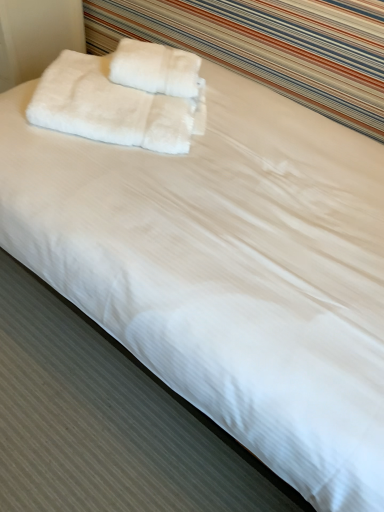
Question: Visually, is white fluffy towels at upper left, which is the 1th towel from left to right, positioned to the left or to the right of white fluffy towel at upper center, the 1th towel positioned from the right?

Choices:
 (A) right
 (B) left

Answer: (B)

Question: Is white fluffy towels at upper left, the second towel viewed from the right, bigger or smaller than white fluffy towel at upper center, the 2th towel viewed from the left?

Choices:
 (A) big
 (B) small

Answer: (A)

Question: In terms of height, does white fluffy towels at upper left, the second towel viewed from the right, look taller or shorter compared to white fluffy towel at upper center, the 2th towel viewed from the left?

Choices:
 (A) short
 (B) tall

Answer: (B)

Question: Considering the positions of white fluffy towel at upper center, the 1th towel positioned from the right, and white fluffy towels at upper left, which is the 1th towel from left to right, in the image, is white fluffy towel at upper center, the 1th towel positioned from the right, taller or shorter than white fluffy towels at upper left, which is the 1th towel from left to right,?

Choices:
 (A) tall
 (B) short

Answer: (B)

Question: From the image's perspective, relative to white fluffy towels at upper left, the second towel viewed from the right, is white fluffy towel at upper center, the 1th towel positioned from the right, above or below?

Choices:
 (A) above
 (B) below

Answer: (A)

Question: Is white fluffy towel at upper center, the 1th towel positioned from the right, in front of or behind white fluffy towels at upper left, which is the 1th towel from left to right, in the image?

Choices:
 (A) front
 (B) behind

Answer: (B)

Question: Looking at the image, does white fluffy towel at upper center, the 1th towel positioned from the right, seem bigger or smaller compared to white fluffy towels at upper left, which is the 1th towel from left to right?

Choices:
 (A) small
 (B) big

Answer: (A)